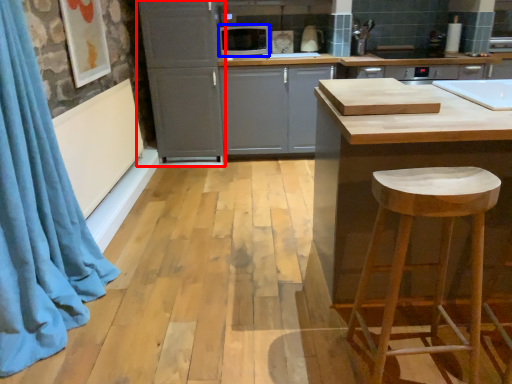
Question: Which of the following is the closest to the observer, cabinetry (highlighted by a red box) or appliance (highlighted by a blue box)?

Choices:
 (A) cabinetry
 (B) appliance

Answer: (A)